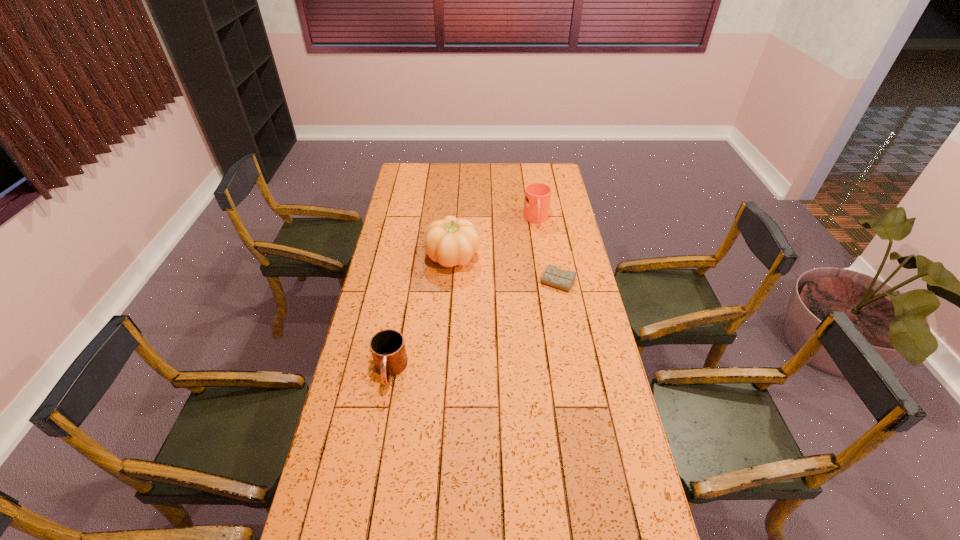
Identify the location of vacant space located on the front of the diary. (564, 313).

Where is `object present at the left edge`? object present at the left edge is located at coordinates (388, 350).

Image resolution: width=960 pixels, height=540 pixels. Identify the location of mug at the right edge. (537, 198).

The width and height of the screenshot is (960, 540). Find the location of `diary located at the right edge`. diary located at the right edge is located at coordinates (553, 276).

Image resolution: width=960 pixels, height=540 pixels. Find the location of `vacant area at the far edge of the desktop`. vacant area at the far edge of the desktop is located at coordinates (481, 166).

Where is `vacant space at the left edge`? The width and height of the screenshot is (960, 540). vacant space at the left edge is located at coordinates click(x=384, y=262).

Find the location of a particular element. free space at the right edge of the desktop is located at coordinates (559, 208).

Identify the location of free space at the far left corner. This screenshot has height=540, width=960. (416, 183).

The height and width of the screenshot is (540, 960). I want to click on free region at the far right corner of the desktop, so click(562, 181).

This screenshot has width=960, height=540. I want to click on vacant space that's between the right mug and the shorter mug, so click(x=463, y=295).